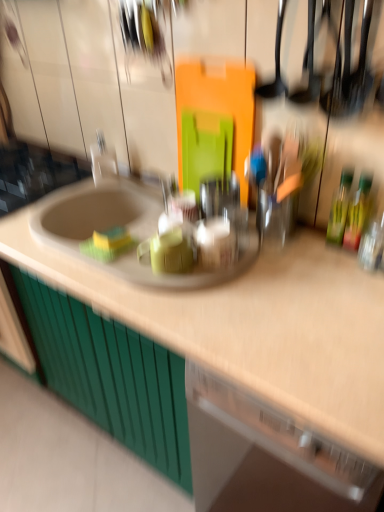
Question: Does green matte cabinet at lower left touch beige laminate countertop at center?

Choices:
 (A) no
 (B) yes

Answer: (A)

Question: Considering the relative sizes of green matte cabinet at lower left and beige laminate countertop at center in the image provided, is green matte cabinet at lower left wider than beige laminate countertop at center?

Choices:
 (A) yes
 (B) no

Answer: (B)

Question: Does green matte cabinet at lower left have a larger size compared to beige laminate countertop at center?

Choices:
 (A) yes
 (B) no

Answer: (B)

Question: Is beige laminate countertop at center inside green matte cabinet at lower left?

Choices:
 (A) yes
 (B) no

Answer: (B)

Question: Is green matte cabinet at lower left shorter than beige laminate countertop at center?

Choices:
 (A) no
 (B) yes

Answer: (B)

Question: From the image's perspective, is green matte cabinet at lower left on top of beige laminate countertop at center?

Choices:
 (A) no
 (B) yes

Answer: (A)

Question: From the image's perspective, is white glossy faucet at upper left below beige laminate countertop at center?

Choices:
 (A) yes
 (B) no

Answer: (B)

Question: Considering the relative sizes of white glossy faucet at upper left and beige laminate countertop at center in the image provided, is white glossy faucet at upper left taller than beige laminate countertop at center?

Choices:
 (A) no
 (B) yes

Answer: (A)

Question: Is white glossy faucet at upper left outside of beige laminate countertop at center?

Choices:
 (A) no
 (B) yes

Answer: (B)

Question: Does white glossy faucet at upper left have a lesser width compared to beige laminate countertop at center?

Choices:
 (A) no
 (B) yes

Answer: (B)

Question: Is white glossy faucet at upper left bigger than beige laminate countertop at center?

Choices:
 (A) yes
 (B) no

Answer: (B)

Question: Can you confirm if white glossy faucet at upper left is positioned to the left of beige laminate countertop at center?

Choices:
 (A) no
 (B) yes

Answer: (A)

Question: Can you confirm if white glossy faucet at upper left is positioned to the left of green glass bottle at right, the 1th bottle when ordered from left to right?

Choices:
 (A) yes
 (B) no

Answer: (A)